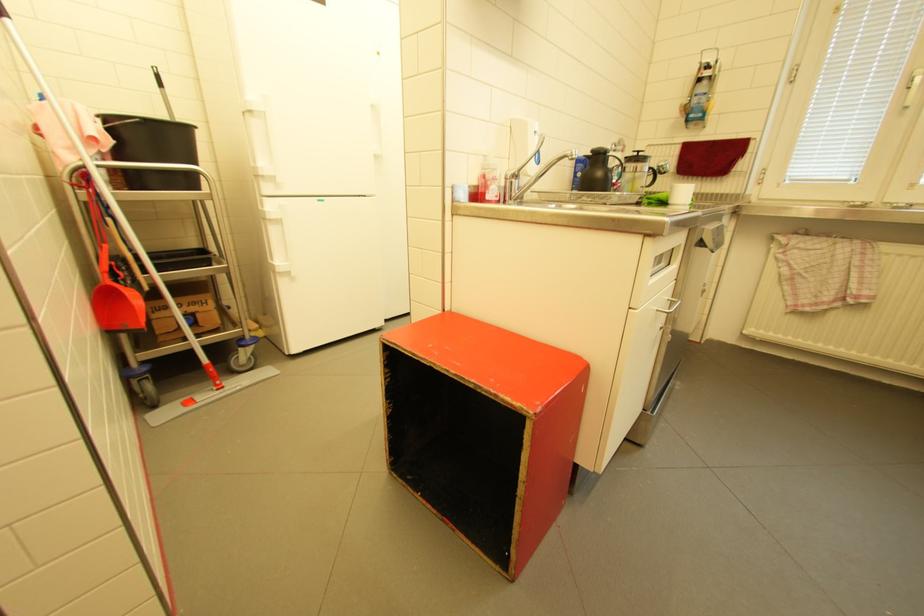
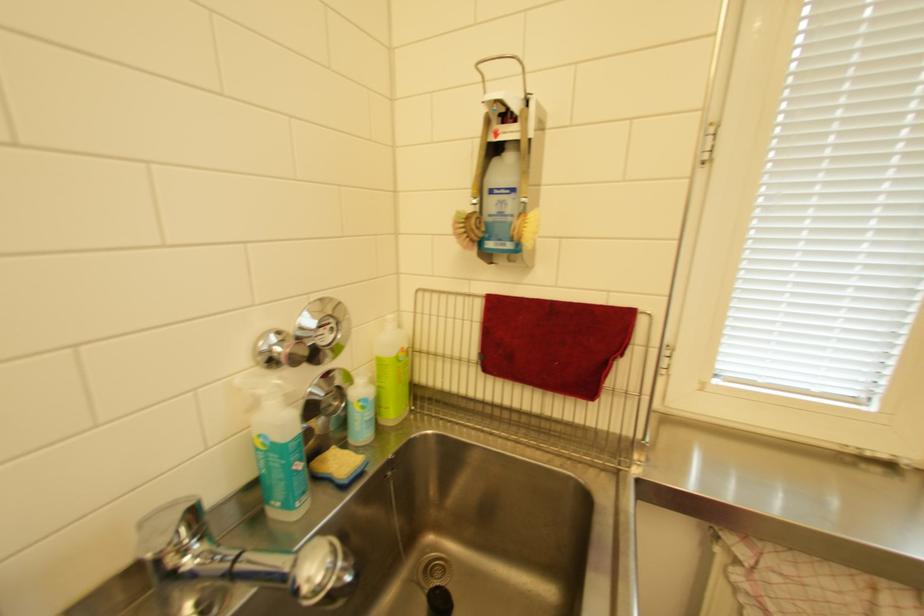
Locate, in the second image, the point that corresponds to (x=694, y=105) in the first image.

(475, 217)